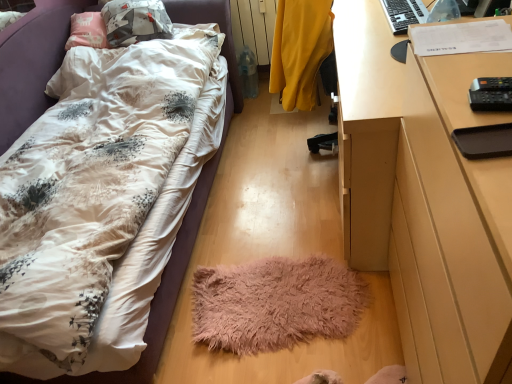
Question: Considering the relative sizes of fluffy white bed at lower left and black plastic remote control at right in the image provided, is fluffy white bed at lower left taller than black plastic remote control at right?

Choices:
 (A) no
 (B) yes

Answer: (B)

Question: From the image's perspective, is fluffy white bed at lower left below black plastic remote control at right?

Choices:
 (A) no
 (B) yes

Answer: (A)

Question: Can you confirm if fluffy white bed at lower left is positioned to the left of black plastic remote control at right?

Choices:
 (A) no
 (B) yes

Answer: (B)

Question: Can you confirm if fluffy white bed at lower left is thinner than black plastic remote control at right?

Choices:
 (A) no
 (B) yes

Answer: (A)

Question: Could black plastic remote control at right be considered to be inside fluffy white bed at lower left?

Choices:
 (A) yes
 (B) no

Answer: (B)

Question: Is yellow fabric chair at center wider or thinner than fluffy white bed at lower left?

Choices:
 (A) wide
 (B) thin

Answer: (B)

Question: Does point (317, 41) appear closer or farther from the camera than point (201, 201)?

Choices:
 (A) farther
 (B) closer

Answer: (B)

Question: In terms of size, does yellow fabric chair at center appear bigger or smaller than fluffy white bed at lower left?

Choices:
 (A) small
 (B) big

Answer: (A)

Question: Considering the positions of yellow fabric chair at center and fluffy white bed at lower left in the image, is yellow fabric chair at center taller or shorter than fluffy white bed at lower left?

Choices:
 (A) short
 (B) tall

Answer: (A)

Question: From a real-world perspective, is yellow matte radiator at upper center physically located above or below yellow fabric chair at center?

Choices:
 (A) above
 (B) below

Answer: (B)

Question: From the image's perspective, is yellow matte radiator at upper center located above or below yellow fabric chair at center?

Choices:
 (A) above
 (B) below

Answer: (A)

Question: Is yellow matte radiator at upper center inside or outside of yellow fabric chair at center?

Choices:
 (A) inside
 (B) outside

Answer: (B)

Question: Looking at their shapes, would you say yellow matte radiator at upper center is wider or thinner than yellow fabric chair at center?

Choices:
 (A) wide
 (B) thin

Answer: (B)

Question: From the image's perspective, is yellow matte radiator at upper center above or below black plastic keyboard at upper right?

Choices:
 (A) below
 (B) above

Answer: (B)

Question: Is yellow matte radiator at upper center in front of or behind black plastic keyboard at upper right in the image?

Choices:
 (A) front
 (B) behind

Answer: (B)